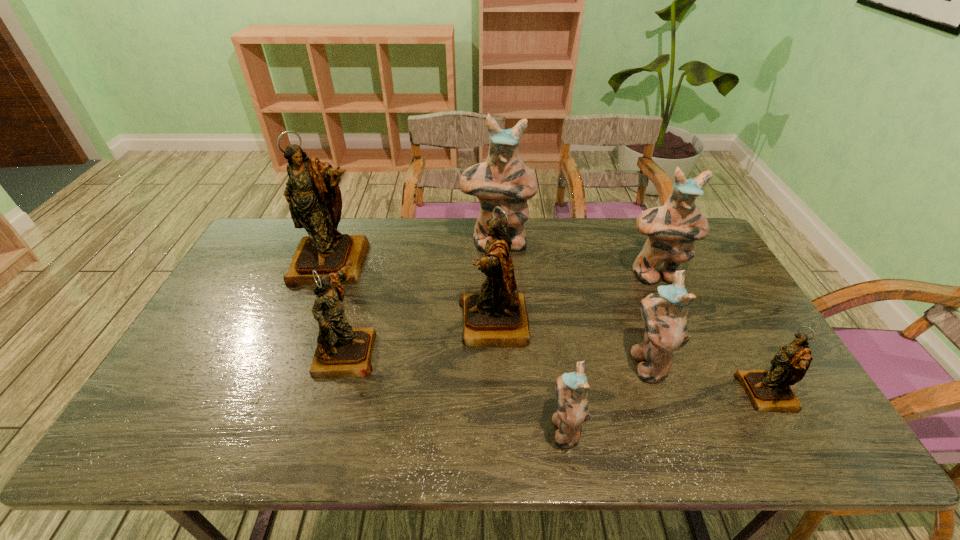
The width and height of the screenshot is (960, 540). I want to click on the biggest pink figurine, so click(x=504, y=180).

Where is `the farthest gold figurine`? This screenshot has width=960, height=540. the farthest gold figurine is located at coordinates (315, 202).

Where is `the third nearest pink figurine`? Image resolution: width=960 pixels, height=540 pixels. the third nearest pink figurine is located at coordinates (672, 228).

The height and width of the screenshot is (540, 960). Identify the location of the second biggest gold figurine. (497, 317).

Find the location of `the second smallest gold figurine`. the second smallest gold figurine is located at coordinates (341, 351).

Locate an element on the screen. The width and height of the screenshot is (960, 540). the third farthest pink figurine is located at coordinates (664, 314).

You are a GUI agent. You are given a task and a screenshot of the screen. Output one action in this format:
    pyautogui.click(x=<x>, y=<y>)
    Task: Click on the rightmost gold figurine
    
    Given the screenshot: What is the action you would take?
    pyautogui.click(x=769, y=390)

I want to click on the nearest pink figurine, so click(x=571, y=388).

The height and width of the screenshot is (540, 960). Find the location of `vacant space located 0.200m on the front-facing side of the farthest pink figurine`. vacant space located 0.200m on the front-facing side of the farthest pink figurine is located at coordinates (499, 297).

At what (x,y) coordinates should I click in order to perform the action: click on vacant position located on the front-facing side of the farthest gold figurine. Please return your answer as a coordinate pair (x, y). Looking at the image, I should click on (308, 324).